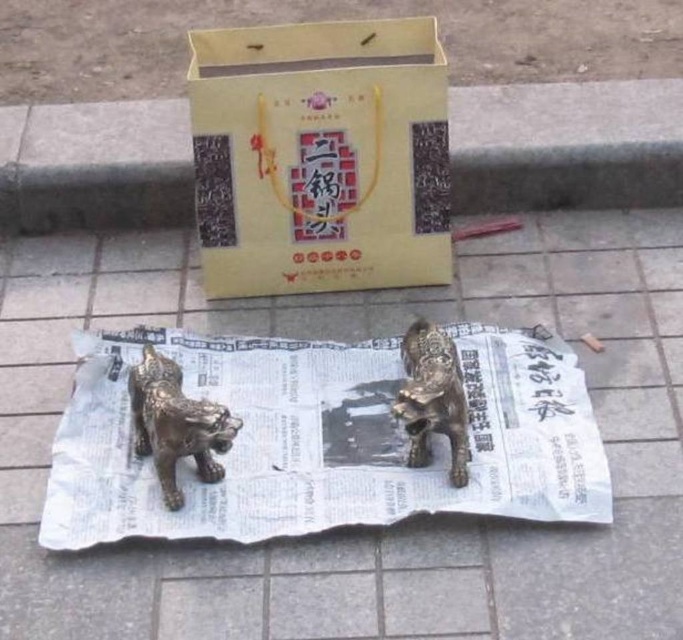
Question: Is gold metallic lion statues at center smaller than matte cardboard box at upper center?

Choices:
 (A) yes
 (B) no

Answer: (B)

Question: Estimate the real-world distances between objects in this image. Which object is closer to the matte cardboard box at upper center?

Choices:
 (A) gold metallic newspaper at center
 (B) shiny bronze lion at center
 (C) gold metallic lion statues at center

Answer: (C)

Question: Considering the real-world distances, which object is farthest from the shiny bronze lion at center?

Choices:
 (A) gold metallic lion at center
 (B) gold metallic newspaper at center
 (C) matte gold paper bag at upper center

Answer: (C)

Question: Among these points, which one is nearest to the camera?

Choices:
 (A) (438, 353)
 (B) (133, 371)
 (C) (464, 156)
 (D) (1, 499)

Answer: (D)

Question: Is gold metallic newspaper at center to the right of matte cardboard box at upper center from the viewer's perspective?

Choices:
 (A) yes
 (B) no

Answer: (B)

Question: Does gold metallic lion statues at center lie in front of gold metallic lion at center?

Choices:
 (A) yes
 (B) no

Answer: (A)